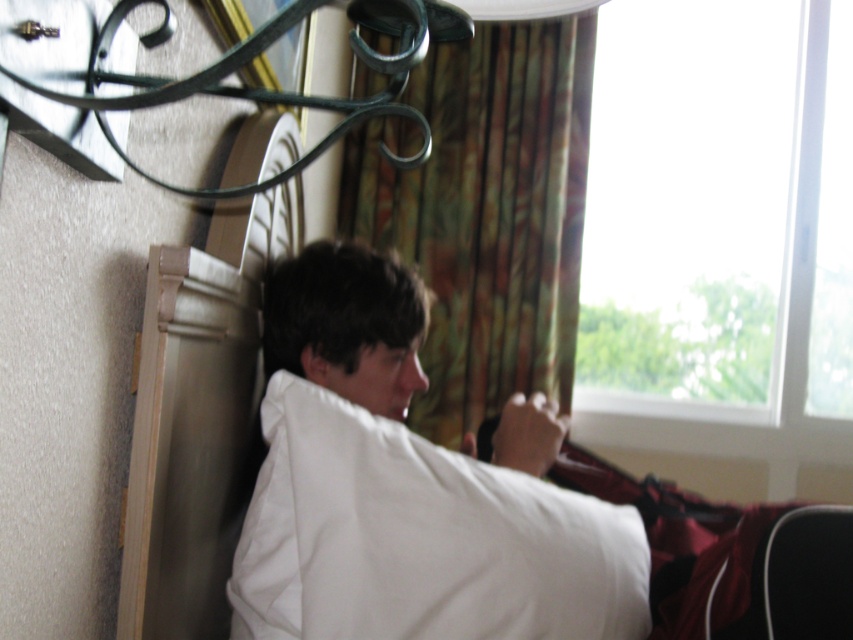
You are a photographer aiming to capture the white soft pillow at center in a closeup shot. Given that your camera has a focal length of 50mm and you want to fill the frame with the pillow, would you need to move closer or farther away from the pillow based on its position?

The position of the white soft pillow at center is at point (421, 540), which indicates it is positioned closer to the camera. To fill the frame with the pillow, you would need to move farther away to adjust the perspective and ensure the pillow occupies the desired portion of the image.

You are a delivery person entering the room and need to hand a package to the person on the bed. The transparent glass window at upper right and the white soft pillow at center are in your line of sight. Which object should you avoid touching to ensure you don not disturb the person?

You should avoid touching the white soft pillow at center because it is closer to the person on the bed than the transparent glass window at upper right, which is further away.

You are trying to decide whether to place a new decorative pillow on the bed. The existing white soft pillow at center is smaller in width than the multicolored fabric curtain at center. Can the new pillow, which is the same size as the curtain, fit on the bed without overlapping the existing pillow?

The white soft pillow at center has a lesser width compared to multicolored fabric curtain at center. Since the new pillow is the same size as the curtain, it would be wider than the existing pillow. However, the bed has enough space to accommodate both pillows without overlapping as long as they are placed appropriately.